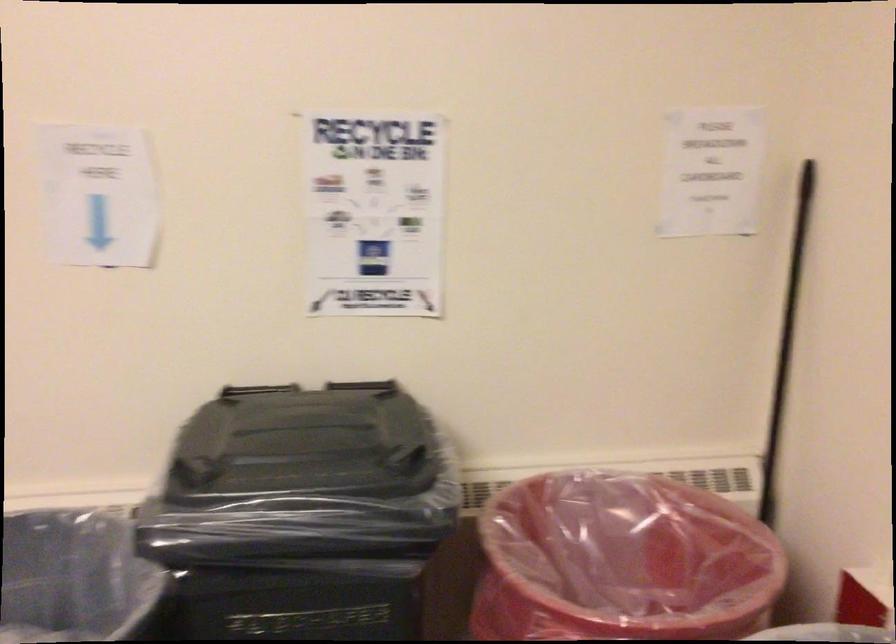
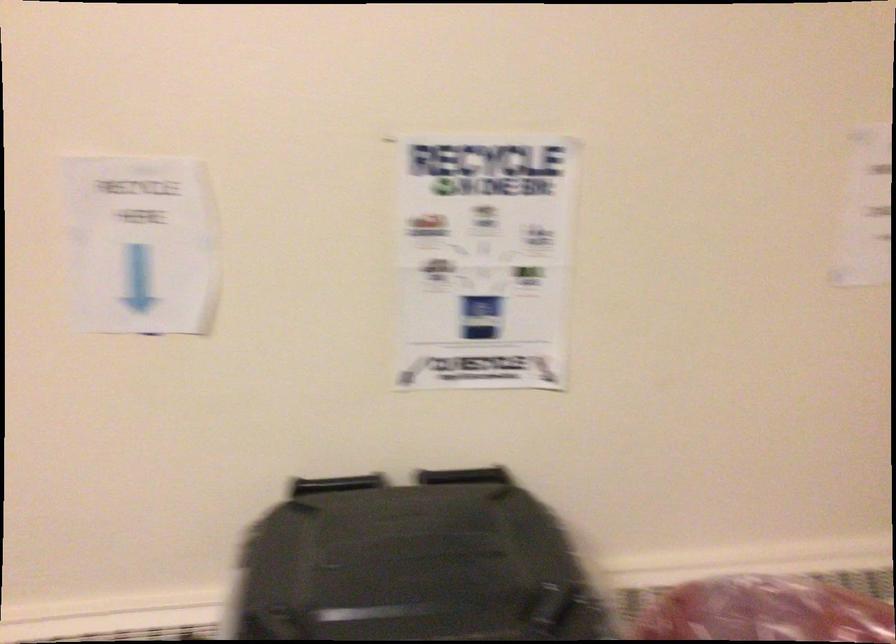
What movement of the cameraman would produce the second image?

The cameraman moved toward left, forward.